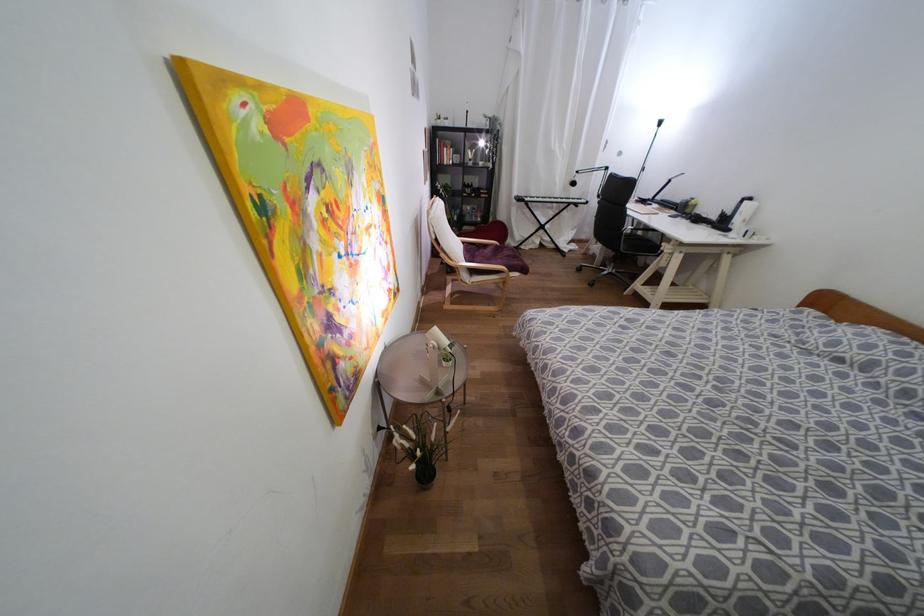
In order to click on chair armrest in this screenshot , I will do `click(478, 265)`.